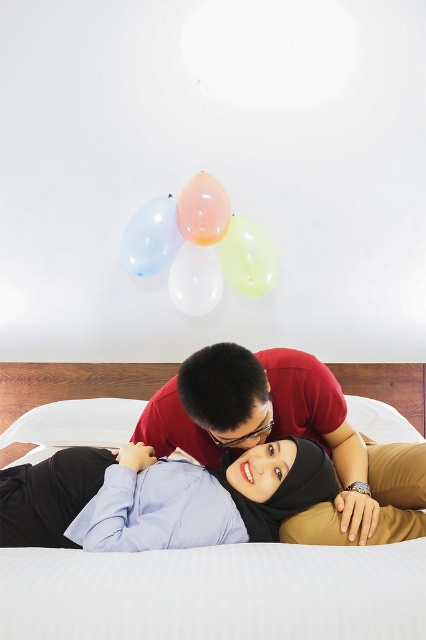
Is white soft pillow at center shorter than translucent yellow balloon at upper center?

Indeed, white soft pillow at center has a lesser height compared to translucent yellow balloon at upper center.

Looking at this image, which is more to the right, white soft pillow at center or translucent yellow balloon at upper center?

translucent yellow balloon at upper center

Measure the distance between white soft pillow at center and camera.

white soft pillow at center and camera are 6.60 feet apart.

I want to click on white soft pillow at center, so click(x=77, y=422).

How distant is white soft bed at center from translucent white balloon at upper center?

white soft bed at center is 4.50 feet away from translucent white balloon at upper center.

Does white soft bed at center come in front of translucent white balloon at upper center?

Yes.

Locate an element on the screen. This screenshot has width=426, height=640. white soft bed at center is located at coordinates 215,593.

This screenshot has height=640, width=426. Find the location of `white soft bed at center`. white soft bed at center is located at coordinates (215, 593).

Who is higher up, translucent yellow balloon at upper center or translucent rubber balloon at upper center?

translucent rubber balloon at upper center

Does translucent yellow balloon at upper center appear over translucent rubber balloon at upper center?

Actually, translucent yellow balloon at upper center is below translucent rubber balloon at upper center.

What do you see at coordinates (247, 257) in the screenshot? This screenshot has height=640, width=426. I see `translucent yellow balloon at upper center` at bounding box center [247, 257].

Where is `translucent yellow balloon at upper center`? This screenshot has height=640, width=426. translucent yellow balloon at upper center is located at coordinates (247, 257).